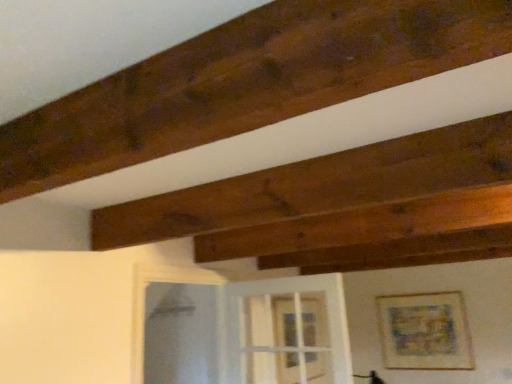
Question: From a real-world perspective, is clear glass screen door at lower center located higher than matte wooden picture frame at upper right?

Choices:
 (A) no
 (B) yes

Answer: (B)

Question: Is clear glass screen door at lower center to the left of matte wooden picture frame at upper right from the viewer's perspective?

Choices:
 (A) yes
 (B) no

Answer: (A)

Question: From the image's perspective, would you say clear glass screen door at lower center is shown under matte wooden picture frame at upper right?

Choices:
 (A) no
 (B) yes

Answer: (A)

Question: Is clear glass screen door at lower center turned away from matte wooden picture frame at upper right?

Choices:
 (A) no
 (B) yes

Answer: (A)

Question: Does clear glass screen door at lower center have a greater width compared to matte wooden picture frame at upper right?

Choices:
 (A) yes
 (B) no

Answer: (A)

Question: From the image's perspective, would you say clear glass screen door at lower center is positioned over matte wooden picture frame at upper right?

Choices:
 (A) yes
 (B) no

Answer: (A)

Question: From a real-world perspective, is transparent glass door at center below clear glass screen door at lower center?

Choices:
 (A) yes
 (B) no

Answer: (A)

Question: Can you confirm if transparent glass door at center is taller than clear glass screen door at lower center?

Choices:
 (A) no
 (B) yes

Answer: (A)

Question: Are transparent glass door at center and clear glass screen door at lower center making contact?

Choices:
 (A) yes
 (B) no

Answer: (B)

Question: From a real-world perspective, is transparent glass door at center physically above clear glass screen door at lower center?

Choices:
 (A) no
 (B) yes

Answer: (A)

Question: Is transparent glass door at center far away from clear glass screen door at lower center?

Choices:
 (A) yes
 (B) no

Answer: (A)

Question: Would you say transparent glass door at center is outside clear glass screen door at lower center?

Choices:
 (A) no
 (B) yes

Answer: (B)

Question: Are matte wooden picture frame at upper right and transparent glass door at center far apart?

Choices:
 (A) no
 (B) yes

Answer: (A)